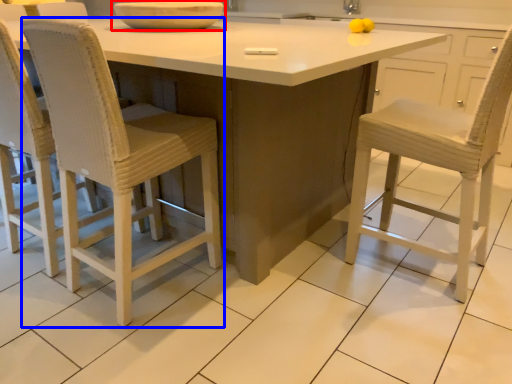
Question: Among these objects, which one is farthest to the camera, bowl (highlighted by a red box) or chair (highlighted by a blue box)?

Choices:
 (A) bowl
 (B) chair

Answer: (A)